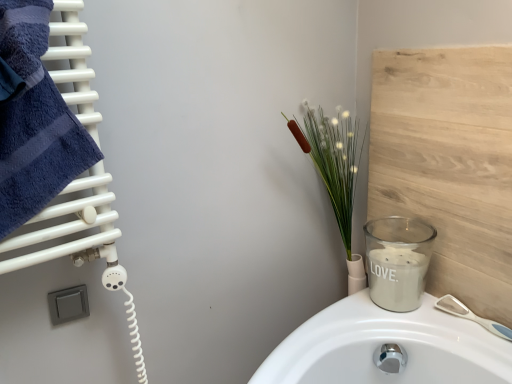
Measure the distance between blue terry cloth towel at left and camera.

25.98 inches.

Identify the location of blue terry cloth towel at left. This screenshot has height=384, width=512. (34, 120).

What is the approximate height of blue terry cloth towel at left?

The height of blue terry cloth towel at left is 43.33 centimeters.

The width and height of the screenshot is (512, 384). Describe the element at coordinates (34, 120) in the screenshot. I see `blue terry cloth towel at left` at that location.

This screenshot has width=512, height=384. I want to click on blue terry cloth towel at left, so click(x=34, y=120).